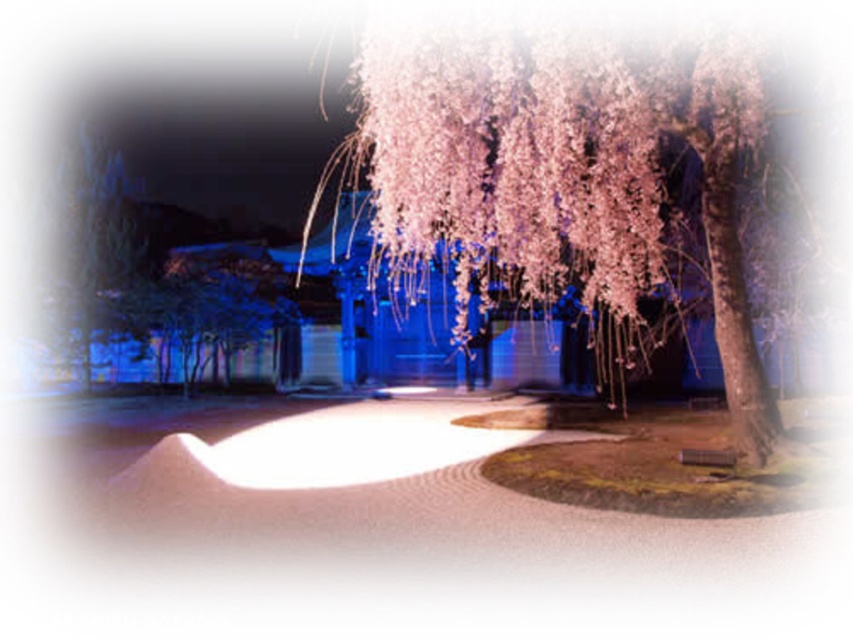
Question: Does pink blossoms at center appear over smooth gray stone wall at left?

Choices:
 (A) yes
 (B) no

Answer: (A)

Question: Can you confirm if pink blossoms at center is positioned above smooth gray stone wall at left?

Choices:
 (A) yes
 (B) no

Answer: (A)

Question: Which object is farther from the camera taking this photo?

Choices:
 (A) pink blossoms at center
 (B) smooth gray stone wall at left

Answer: (B)

Question: Which point is farther to the camera?

Choices:
 (A) smooth gray stone wall at left
 (B) pink blossoms at center

Answer: (A)

Question: Among these points, which one is nearest to the camera?

Choices:
 (A) (102, 237)
 (B) (601, 72)

Answer: (B)

Question: Is pink blossoms at center bigger than smooth gray stone wall at left?

Choices:
 (A) no
 (B) yes

Answer: (B)